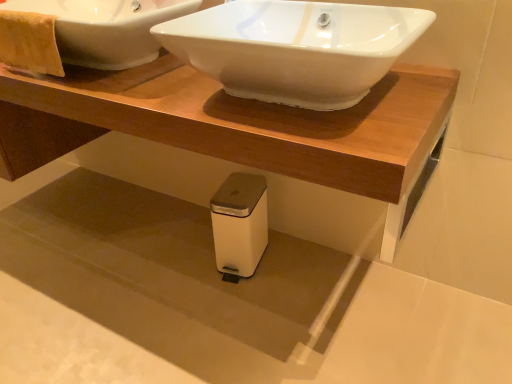
Where is `white matte trash can at lower center`? The width and height of the screenshot is (512, 384). white matte trash can at lower center is located at coordinates [240, 223].

The image size is (512, 384). What do you see at coordinates (295, 48) in the screenshot? I see `white glossy sink at upper center, marked as the 1th sink in a right-to-left arrangement` at bounding box center [295, 48].

Where is `white glossy sink at upper center, marked as the 1th sink in a right-to-left arrangement`? The height and width of the screenshot is (384, 512). white glossy sink at upper center, marked as the 1th sink in a right-to-left arrangement is located at coordinates (295, 48).

In order to face white glossy sink at upper center, which is the 2th sink from right to left, should I rotate leftwards or rightwards?

A 20.201 degree turn to the left will do.

In order to click on yellow textured towel at upper left in this screenshot , I will do `click(29, 42)`.

From a real-world perspective, is white glossy sink at upper center, acting as the 1th sink starting from the left, positioned over white plastic trash can at lower center based on gravity?

Yes, from a real-world perspective, white glossy sink at upper center, acting as the 1th sink starting from the left, is over white plastic trash can at lower center

The image size is (512, 384). Identify the location of sink that is the 2nd one when counting backward from the white plastic trash can at lower center. (106, 28).

Is white glossy sink at upper center, which is the 2th sink from right to left, inside the boundaries of white plastic trash can at lower center, or outside?

white glossy sink at upper center, which is the 2th sink from right to left, exists outside the volume of white plastic trash can at lower center.

Is white glossy sink at upper center, acting as the 1th sink starting from the left, situated inside white glossy sink at upper center, marked as the 1th sink in a right-to-left arrangement, or outside?

white glossy sink at upper center, acting as the 1th sink starting from the left, is located beyond the bounds of white glossy sink at upper center, marked as the 1th sink in a right-to-left arrangement.

Could you tell me if white glossy sink at upper center, acting as the 1th sink starting from the left, is facing white glossy sink at upper center, placed as the second sink when sorted from left to right?

No, white glossy sink at upper center, acting as the 1th sink starting from the left, is not aimed at white glossy sink at upper center, placed as the second sink when sorted from left to right.

Who is smaller, white glossy sink at upper center, acting as the 1th sink starting from the left, or white glossy sink at upper center, marked as the 1th sink in a right-to-left arrangement?

white glossy sink at upper center, marked as the 1th sink in a right-to-left arrangement.

Does white glossy sink at upper center, acting as the 1th sink starting from the left, have a lesser height compared to white glossy sink at upper center, placed as the second sink when sorted from left to right?

No, white glossy sink at upper center, acting as the 1th sink starting from the left, is not shorter than white glossy sink at upper center, placed as the second sink when sorted from left to right.

Is the surface of yellow textured towel at upper left in direct contact with white matte trash can at lower center?

There is a gap between yellow textured towel at upper left and white matte trash can at lower center.

Is yellow textured towel at upper left shorter than white matte trash can at lower center?

Indeed, yellow textured towel at upper left has a lesser height compared to white matte trash can at lower center.

Is point (39, 48) in front of point (229, 208)?

That is True.

Is white glossy sink at upper center, marked as the 1th sink in a right-to-left arrangement, turned away from white matte trash can at lower center?

No, white matte trash can at lower center is not at the back of white glossy sink at upper center, marked as the 1th sink in a right-to-left arrangement.

Considering the relative sizes of white glossy sink at upper center, marked as the 1th sink in a right-to-left arrangement, and white matte trash can at lower center in the image provided, is white glossy sink at upper center, marked as the 1th sink in a right-to-left arrangement, taller than white matte trash can at lower center?

Incorrect, the height of white glossy sink at upper center, marked as the 1th sink in a right-to-left arrangement, is not larger of that of white matte trash can at lower center.

Are white glossy sink at upper center, marked as the 1th sink in a right-to-left arrangement, and white matte trash can at lower center located far from each other?

Actually, white glossy sink at upper center, marked as the 1th sink in a right-to-left arrangement, and white matte trash can at lower center are a little close together.

Which object is further away from the camera taking this photo, white glossy sink at upper center, marked as the 1th sink in a right-to-left arrangement, or white matte trash can at lower center?

white matte trash can at lower center is further from the camera.

Between white glossy sink at upper center, placed as the second sink when sorted from left to right, and white plastic trash can at lower center, which one has larger size?

white plastic trash can at lower center is bigger.

Which sink is the 1st one when counting from the back of the white plastic trash can at lower center? Please provide its 2D coordinates.

[(295, 48)]

Is white plastic trash can at lower center at the back of white glossy sink at upper center, marked as the 1th sink in a right-to-left arrangement?

That's not correct — white glossy sink at upper center, marked as the 1th sink in a right-to-left arrangement, is not looking away from white plastic trash can at lower center.

Does white glossy sink at upper center, marked as the 1th sink in a right-to-left arrangement, appear on the left side of white plastic trash can at lower center?

Incorrect, white glossy sink at upper center, marked as the 1th sink in a right-to-left arrangement, is not on the left side of white plastic trash can at lower center.

Considering the sizes of white plastic trash can at lower center and white glossy sink at upper center, placed as the second sink when sorted from left to right, in the image, is white plastic trash can at lower center bigger or smaller than white glossy sink at upper center, placed as the second sink when sorted from left to right,?

Considering their sizes, white plastic trash can at lower center takes up more space than white glossy sink at upper center, placed as the second sink when sorted from left to right.

Consider the image. Is white plastic trash can at lower center directly adjacent to white glossy sink at upper center, marked as the 1th sink in a right-to-left arrangement?

white plastic trash can at lower center is not next to white glossy sink at upper center, marked as the 1th sink in a right-to-left arrangement, and they're not touching.

Is white plastic trash can at lower center spatially inside white glossy sink at upper center, placed as the second sink when sorted from left to right, or outside of it?

white plastic trash can at lower center is not inside white glossy sink at upper center, placed as the second sink when sorted from left to right, it's outside.

From a real-world perspective, who is located lower, white plastic trash can at lower center or white glossy sink at upper center, marked as the 1th sink in a right-to-left arrangement?

From a 3D spatial view, white plastic trash can at lower center is below.

Is white matte trash can at lower center positioned with its back to white plastic trash can at lower center?

No, white matte trash can at lower center's orientation is not away from white plastic trash can at lower center.

Is white matte trash can at lower center taller or shorter than white plastic trash can at lower center?

Considering their sizes, white matte trash can at lower center has less height than white plastic trash can at lower center.

Which object is positioned more to the left, white matte trash can at lower center or white plastic trash can at lower center?

Positioned to the left is white plastic trash can at lower center.

Considering the positions of objects white matte trash can at lower center and white plastic trash can at lower center in the image provided, who is behind, white matte trash can at lower center or white plastic trash can at lower center?

white matte trash can at lower center is further away from the camera.

You are a GUI agent. You are given a task and a screenshot of the screen. Output one action in this format:
    pyautogui.click(x=<x>, y=<y>)
    Task: Click on the table lying below the white glossy sink at upper center, which is the 2th sink from right to left (from the image's perspective)
    
    Given the screenshot: What is the action you would take?
    (231, 123)

Find the location of a particular element. sink on the left of white glossy sink at upper center, marked as the 1th sink in a right-to-left arrangement is located at coordinates (106, 28).

Which object lies further to the anchor point white glossy sink at upper center, placed as the second sink when sorted from left to right, white plastic trash can at lower center or yellow textured towel at upper left?

yellow textured towel at upper left is positioned further to the anchor white glossy sink at upper center, placed as the second sink when sorted from left to right.

Estimate the real-world distances between objects in this image. Which object is further from white matte trash can at lower center, white glossy sink at upper center, acting as the 1th sink starting from the left, or white glossy sink at upper center, marked as the 1th sink in a right-to-left arrangement?

white glossy sink at upper center, acting as the 1th sink starting from the left, lies further to white matte trash can at lower center than the other object.

Based on the photo, looking at the image, which one is located further to white glossy sink at upper center, acting as the 1th sink starting from the left, white glossy sink at upper center, placed as the second sink when sorted from left to right, or yellow textured towel at upper left?

white glossy sink at upper center, placed as the second sink when sorted from left to right, is further to white glossy sink at upper center, acting as the 1th sink starting from the left.

Which object lies further to the anchor point white plastic trash can at lower center, white matte trash can at lower center or white glossy sink at upper center, placed as the second sink when sorted from left to right?

white matte trash can at lower center lies further to white plastic trash can at lower center than the other object.

Looking at the image, which one is located closer to yellow textured towel at upper left, white plastic trash can at lower center or white glossy sink at upper center, acting as the 1th sink starting from the left?

Based on the image, white glossy sink at upper center, acting as the 1th sink starting from the left, appears to be nearer to yellow textured towel at upper left.

Considering their positions, is white plastic trash can at lower center positioned closer to white glossy sink at upper center, acting as the 1th sink starting from the left, than white glossy sink at upper center, marked as the 1th sink in a right-to-left arrangement?

white plastic trash can at lower center.

Estimate the real-world distances between objects in this image. Which object is closer to white glossy sink at upper center, acting as the 1th sink starting from the left, white plastic trash can at lower center or white matte trash can at lower center?

white plastic trash can at lower center is positioned closer to the anchor white glossy sink at upper center, acting as the 1th sink starting from the left.

Based on their spatial positions, is white glossy sink at upper center, acting as the 1th sink starting from the left, or white matte trash can at lower center further from white plastic trash can at lower center?

The object further to white plastic trash can at lower center is white matte trash can at lower center.

Where is `table between white glossy sink at upper center, which is the 2th sink from right to left, and white glossy sink at upper center, marked as the 1th sink in a right-to-left arrangement`? The image size is (512, 384). table between white glossy sink at upper center, which is the 2th sink from right to left, and white glossy sink at upper center, marked as the 1th sink in a right-to-left arrangement is located at coordinates (231, 123).

In order to click on table between yellow textured towel at upper left and white glossy sink at upper center, marked as the 1th sink in a right-to-left arrangement, from left to right in this screenshot , I will do `click(231, 123)`.

This screenshot has height=384, width=512. I want to click on hand towel between white glossy sink at upper center, acting as the 1th sink starting from the left, and white matte trash can at lower center, in the vertical direction, so click(x=29, y=42).

Find the location of a particular element. The image size is (512, 384). sink situated between yellow textured towel at upper left and white glossy sink at upper center, placed as the second sink when sorted from left to right, from left to right is located at coordinates (106, 28).